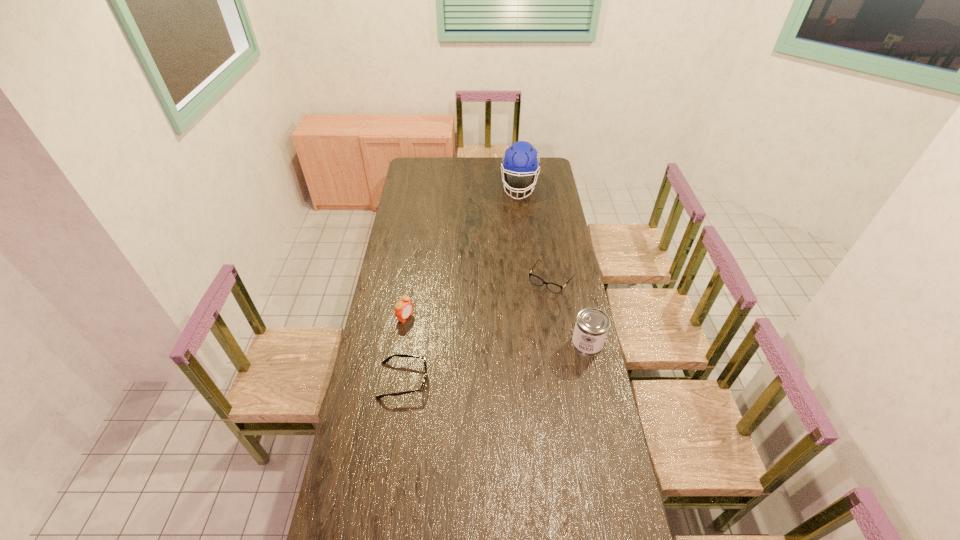
Identify the location of vacant space located on the front-facing side of the football helmet. This screenshot has height=540, width=960. (514, 232).

The height and width of the screenshot is (540, 960). Identify the location of object present at the far edge. (521, 159).

Locate an element on the screen. spectacles present at the left edge is located at coordinates (386, 360).

Where is `alarm clock that is at the left edge`? The width and height of the screenshot is (960, 540). alarm clock that is at the left edge is located at coordinates [x=403, y=308].

At what (x,y) coordinates should I click in order to perform the action: click on can that is at the right edge. Please return your answer as a coordinate pair (x, y). This screenshot has height=540, width=960. Looking at the image, I should click on [591, 327].

Where is `spectacles present at the right edge`? The width and height of the screenshot is (960, 540). spectacles present at the right edge is located at coordinates (536, 280).

Where is `football helmet positioned at the right edge`? The image size is (960, 540). football helmet positioned at the right edge is located at coordinates (521, 159).

Find the location of `object located at the far right corner`. object located at the far right corner is located at coordinates (521, 159).

You are a GUI agent. You are given a task and a screenshot of the screen. Output one action in this format:
    pyautogui.click(x=<x>, y=<y>)
    Task: Click on the free spot at the far edge of the desktop
    
    Given the screenshot: What is the action you would take?
    pyautogui.click(x=443, y=158)

Identify the location of blank space at the left edge. (421, 210).